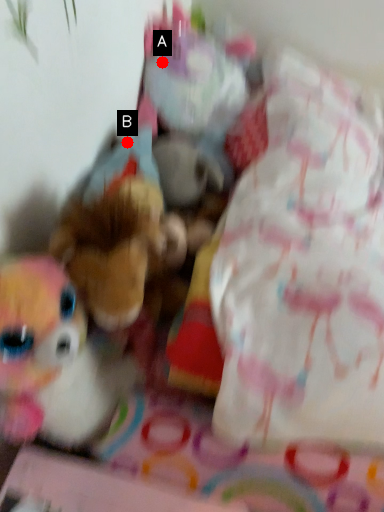
Question: Two points are circled on the image, labeled by A and B beside each circle. Among these points, which one is farthest from the camera?

Choices:
 (A) A is further
 (B) B is further

Answer: (A)